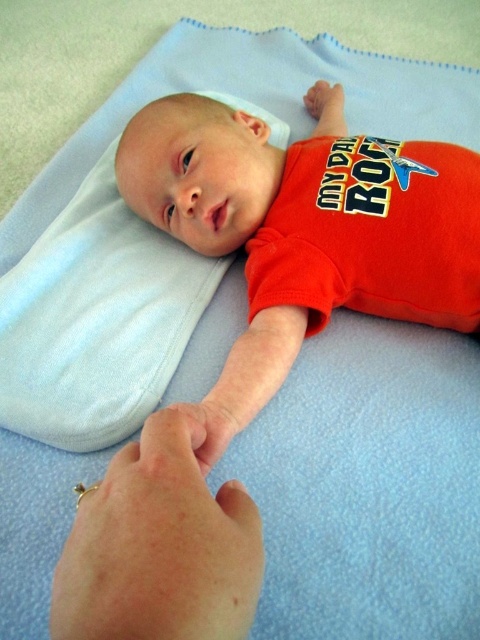
Question: Is matte orange shirt at center in front of soft blue fabric pillow at upper left?

Choices:
 (A) yes
 (B) no

Answer: (A)

Question: Among these objects, which one is nearest to the camera?

Choices:
 (A) matte orange shirt at center
 (B) soft blue fabric pillow at upper left

Answer: (A)

Question: Can you confirm if matte orange shirt at center is positioned below soft blue fabric pillow at upper left?

Choices:
 (A) yes
 (B) no

Answer: (B)

Question: Can you confirm if matte orange shirt at center is positioned above soft blue fabric pillow at upper left?

Choices:
 (A) no
 (B) yes

Answer: (B)